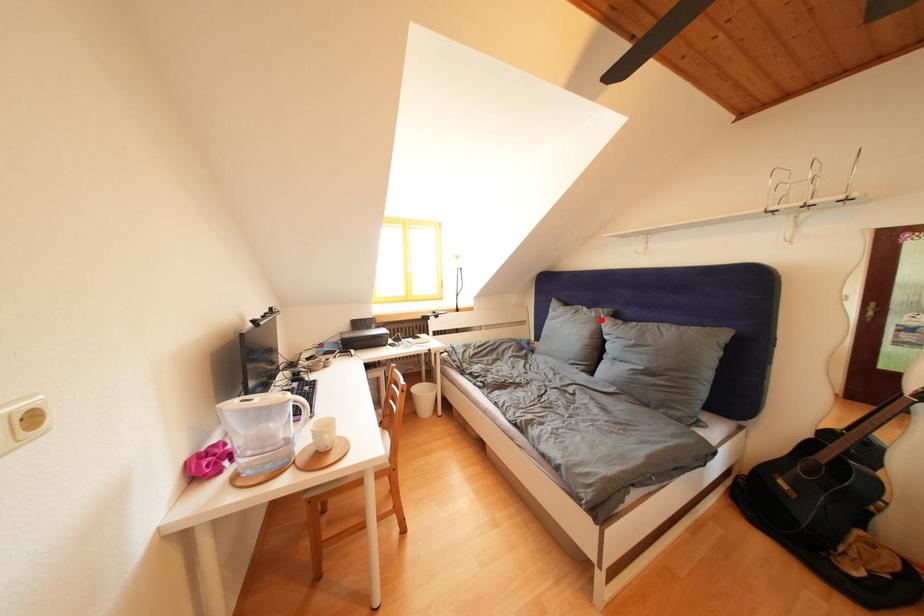
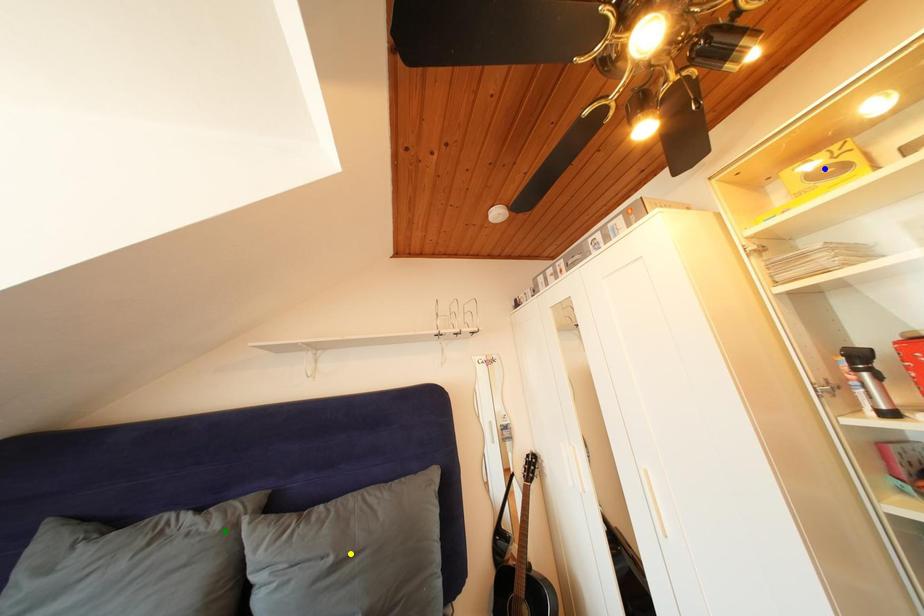
Question: I am providing you with two images of the same scene from different viewpoints. A red point is marked on the first image. You are given multiple points on the second image. Which point in image 2 is actually the same real-world point as the red point in image 1?

Choices:
 (A) green point
 (B) blue point
 (C) yellow point

Answer: (A)